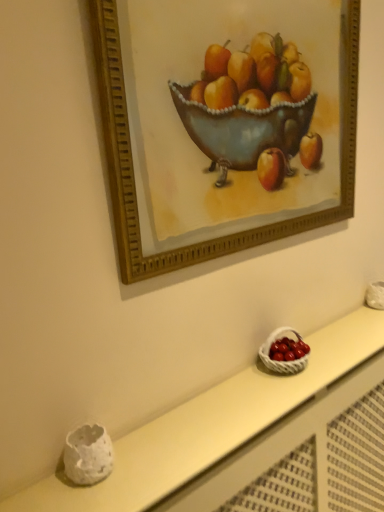
The width and height of the screenshot is (384, 512). What are the coordinates of `vacant space to the right of white wicker basket at lower right` in the screenshot? It's located at (337, 356).